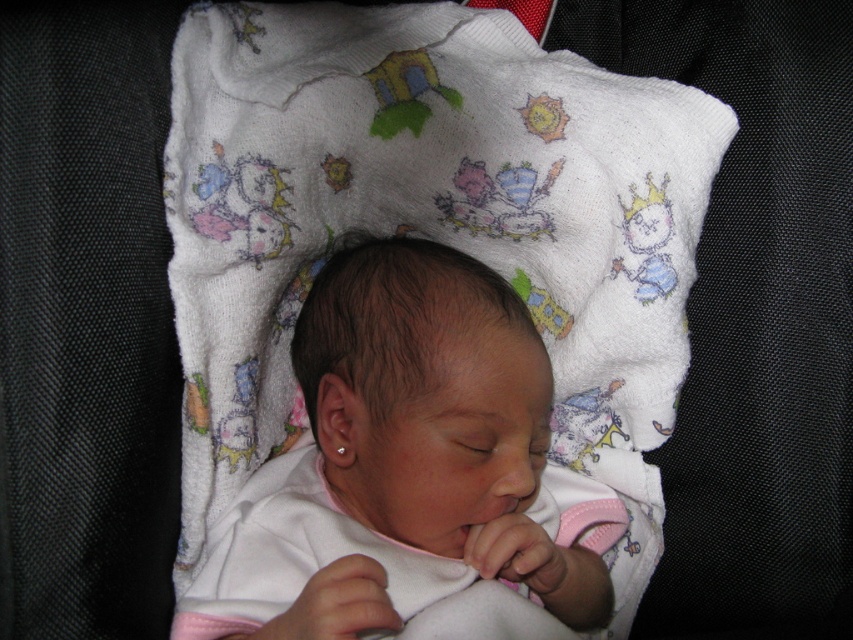
Question: Does smooth pink fabric at center have a greater width compared to clear plastic teething ring at center?

Choices:
 (A) no
 (B) yes

Answer: (B)

Question: Among these points, which one is nearest to the camera?

Choices:
 (A) (345, 449)
 (B) (556, 576)

Answer: (B)

Question: Does smooth pink fabric at center come in front of clear plastic teething ring at center?

Choices:
 (A) yes
 (B) no

Answer: (A)

Question: Among these points, which one is nearest to the camera?

Choices:
 (A) (344, 449)
 (B) (433, 388)

Answer: (B)

Question: Observing the image, what is the correct spatial positioning of smooth pink fabric at center in reference to clear plastic teething ring at center?

Choices:
 (A) below
 (B) above

Answer: (B)